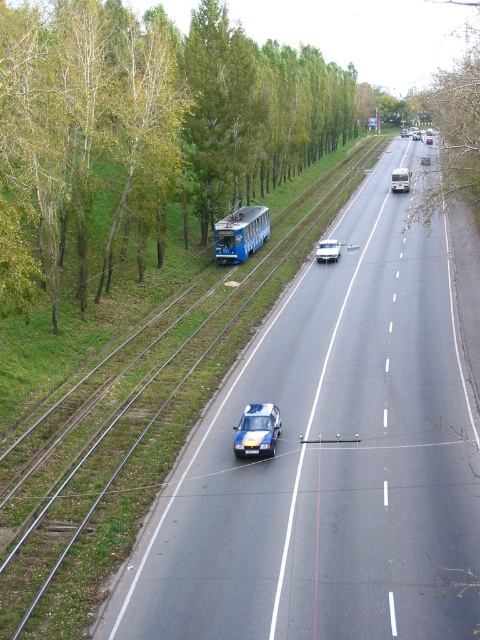
Between smooth asphalt highway at center and blue matte tram at center-left, which one has less height?

Standing shorter between the two is blue matte tram at center-left.

Which is behind, point (142, 608) or point (227, 216)?

The point (227, 216) is more distant.

Who is more distant from viewer, (145, 557) or (252, 227)?

Point (252, 227)

You are a GUI agent. You are given a task and a screenshot of the screen. Output one action in this format:
    pyautogui.click(x=<x>, y=<y>)
    Task: Click on the smooth asphalt highway at center
    Image resolution: width=480 pixels, height=640 pixels.
    Given the screenshot: What is the action you would take?
    pyautogui.click(x=331, y=460)

Can you confirm if smooth asphalt highway at center is taller than green leafy tree at upper left?

No, smooth asphalt highway at center is not taller than green leafy tree at upper left.

Who is shorter, smooth asphalt highway at center or green leafy tree at upper left?

smooth asphalt highway at center is shorter.

You are a GUI agent. You are given a task and a screenshot of the screen. Output one action in this format:
    pyautogui.click(x=<x>, y=<y>)
    Task: Click on the smooth asphalt highway at center
    This screenshot has height=640, width=480.
    Given the screenshot: What is the action you would take?
    pyautogui.click(x=331, y=460)

Who is shorter, green leafy tree at upper right or metallic blue bus at center?

metallic blue bus at center

Between green leafy tree at upper right and metallic blue bus at center, which one appears on the left side from the viewer's perspective?

metallic blue bus at center

This screenshot has width=480, height=640. Describe the element at coordinates (456, 116) in the screenshot. I see `green leafy tree at upper right` at that location.

Locate an element on the screen. The image size is (480, 640). green leafy tree at upper right is located at coordinates (456, 116).